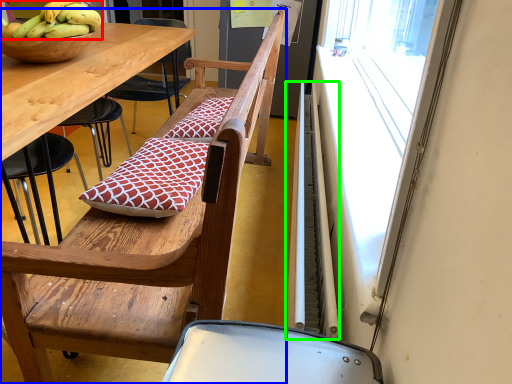
Question: Which object is positioned closest to banana (highlighted by a red box)? Select from chair (highlighted by a blue box) and radiator (highlighted by a green box).

Choices:
 (A) chair
 (B) radiator

Answer: (A)